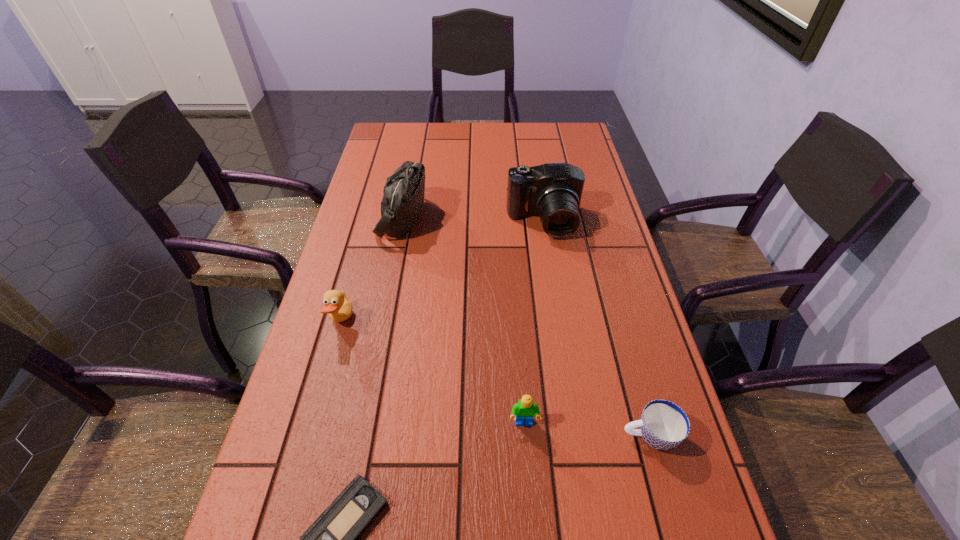
You are a GUI agent. You are given a task and a screenshot of the screen. Output one action in this format:
    pyautogui.click(x=<x>, y=<y>)
    Task: Click on the vacant space located 0.080m on the side of the second shortest object with the handle
    
    Given the screenshot: What is the action you would take?
    pyautogui.click(x=580, y=436)

Image resolution: width=960 pixels, height=540 pixels. I want to click on vacant space located 0.220m on the side of the second shortest object with the handle, so click(507, 436).

Where is `shoulder bag at the left edge`? shoulder bag at the left edge is located at coordinates (403, 199).

What are the coordinates of `duck that is at the left edge` in the screenshot? It's located at (339, 308).

The height and width of the screenshot is (540, 960). Identify the location of camera located at the right edge. click(553, 191).

This screenshot has width=960, height=540. What are the coordinates of `cup present at the right edge` in the screenshot? It's located at (663, 425).

At what (x,y) coordinates should I click in order to perform the action: click on vacant space at the far edge of the desktop. Please return your answer as a coordinate pair (x, y). This screenshot has height=540, width=960. Looking at the image, I should click on (485, 145).

Image resolution: width=960 pixels, height=540 pixels. In order to click on free space at the left edge of the desktop in this screenshot , I will do `click(360, 323)`.

Find the location of a particular element. Image resolution: width=960 pixels, height=540 pixels. blank space at the right edge is located at coordinates (598, 265).

This screenshot has height=540, width=960. Find the location of `blank region between the camera and the shoulder bag`. blank region between the camera and the shoulder bag is located at coordinates (473, 220).